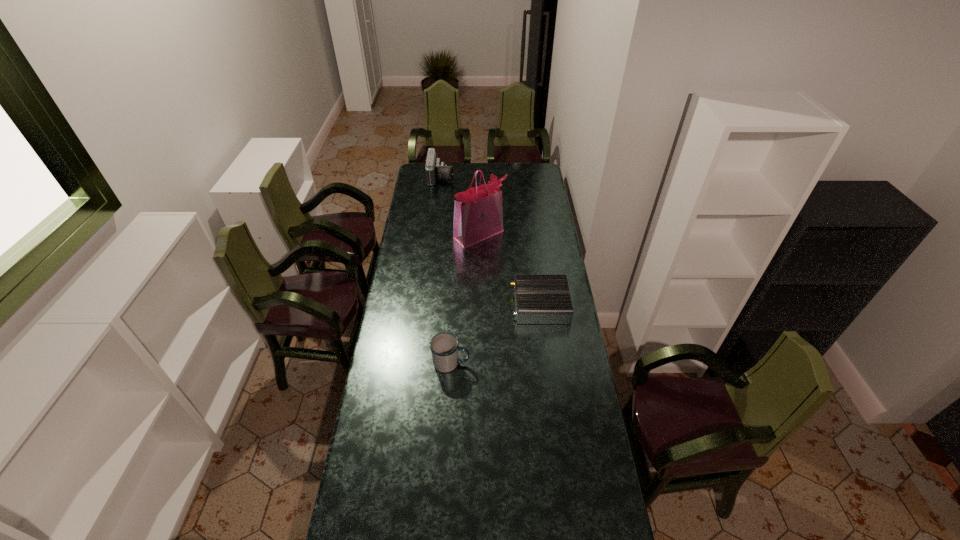
In the image, there is a desktop. Where is `vacant space at the far right corner`? vacant space at the far right corner is located at coordinates (536, 166).

Where is `vacant area that lies between the mug and the shopping bag`? The height and width of the screenshot is (540, 960). vacant area that lies between the mug and the shopping bag is located at coordinates (465, 299).

Locate an element on the screen. The height and width of the screenshot is (540, 960). vacant area between the second shortest object and the third nearest object is located at coordinates (465, 299).

Locate an element on the screen. free space between the second shortest object and the router is located at coordinates tap(495, 334).

You are a GUI agent. You are given a task and a screenshot of the screen. Output one action in this format:
    pyautogui.click(x=<x>, y=<y>)
    Task: Click on the free space between the shopping bag and the mug
    This screenshot has width=960, height=540.
    Given the screenshot: What is the action you would take?
    pyautogui.click(x=465, y=299)

Locate an element on the screen. This screenshot has height=540, width=960. free point between the rightmost object and the farthest object is located at coordinates (491, 241).

I want to click on vacant space that's between the shortest object and the third nearest object, so click(510, 269).

Locate which object ranks third in proximity to the farthest object. Please provide its 2D coordinates. Your answer should be formatted as a tuple, i.e. [(x, y)], where the tuple contains the x and y coordinates of a point satisfying the conditions above.

[(444, 347)]

Select which object is the second closest to the camera. Please provide its 2D coordinates. Your answer should be formatted as a tuple, i.e. [(x, y)], where the tuple contains the x and y coordinates of a point satisfying the conditions above.

[(539, 299)]

The width and height of the screenshot is (960, 540). Identify the location of vacant point that satisfies the following two spatial constraints: 1. at the front of the camera with an open lens cover; 2. on the left side of the tallest object. (434, 234).